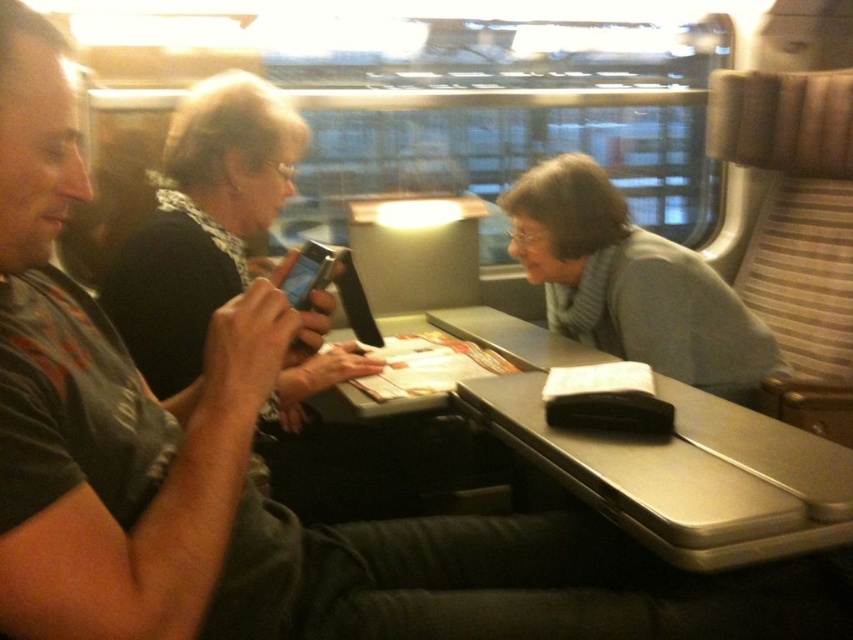
Question: Which of the following is the closest to the observer?

Choices:
 (A) gray knitted scarf at center
 (B) black leather table at center

Answer: (B)

Question: Does black leather table at center have a smaller size compared to gray knitted scarf at center?

Choices:
 (A) yes
 (B) no

Answer: (A)

Question: Does black leather table at center have a greater width compared to gray knitted scarf at center?

Choices:
 (A) yes
 (B) no

Answer: (B)

Question: Does black leather table at center lie behind gray knitted scarf at center?

Choices:
 (A) yes
 (B) no

Answer: (B)